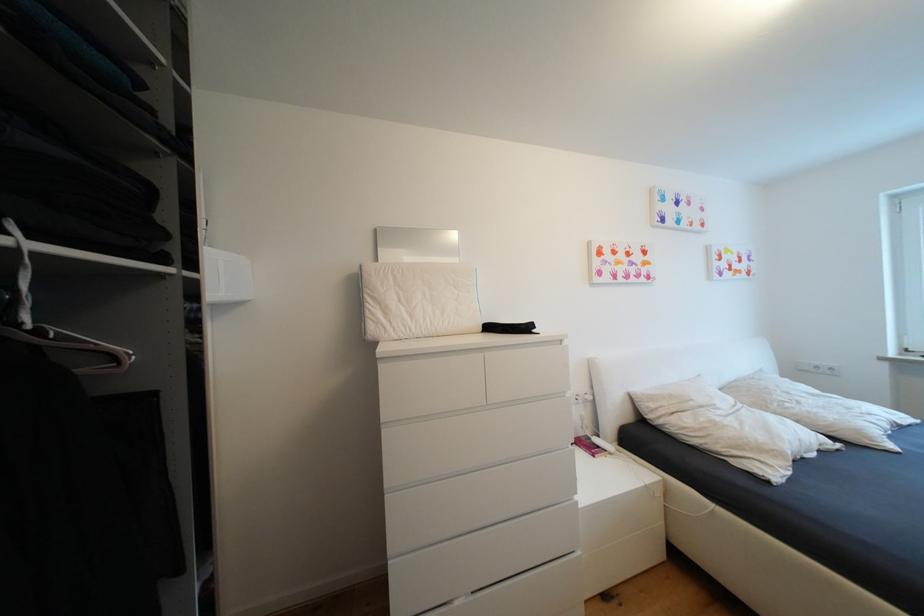
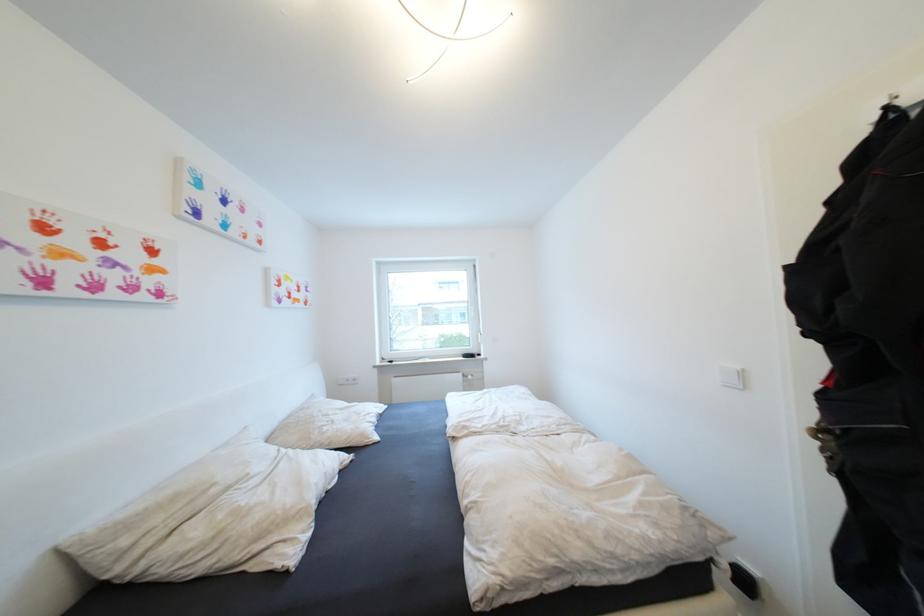
Find the pixel in the second image that matches [806,403] in the first image.

(339, 423)